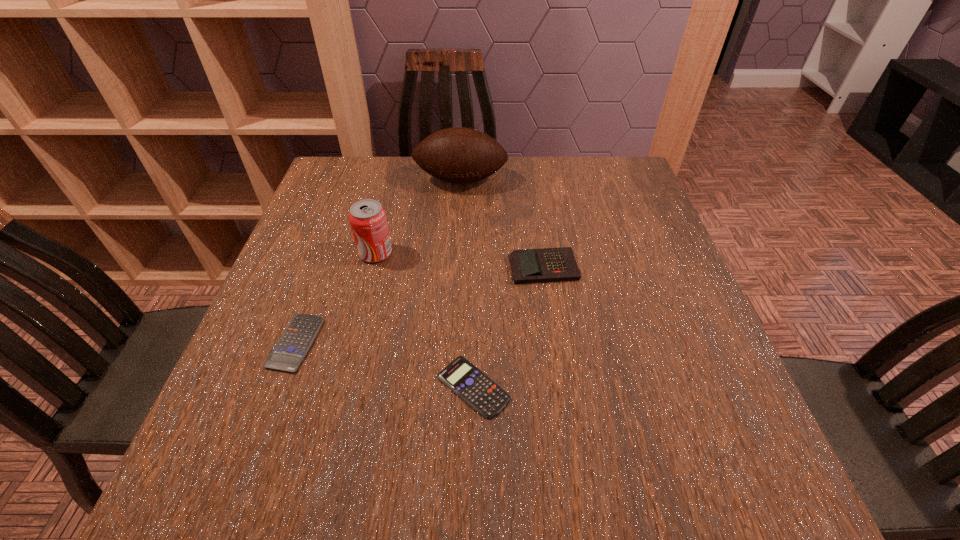
This screenshot has width=960, height=540. I want to click on the farthest object, so click(457, 155).

Locate an element on the screen. Image resolution: width=960 pixels, height=540 pixels. the second object from left to right is located at coordinates (367, 218).

In order to click on the farthest calculator in this screenshot , I will do `click(547, 264)`.

This screenshot has height=540, width=960. I want to click on the rightmost calculator, so click(x=547, y=264).

Image resolution: width=960 pixels, height=540 pixels. In order to click on the second calculator from left to right in this screenshot , I will do `click(480, 392)`.

Identify the location of the leftmost calculator. Image resolution: width=960 pixels, height=540 pixels. (287, 355).

Identify the location of vacant space located on the laces of the farthest object. (459, 222).

Locate an element on the screen. The width and height of the screenshot is (960, 540). free location located on the right of the second object from left to right is located at coordinates (448, 253).

Where is `vacant space located 0.390m on the left of the rightmost calculator`? vacant space located 0.390m on the left of the rightmost calculator is located at coordinates (337, 267).

Identify the location of free location located on the right of the second calculator from left to right. (634, 387).